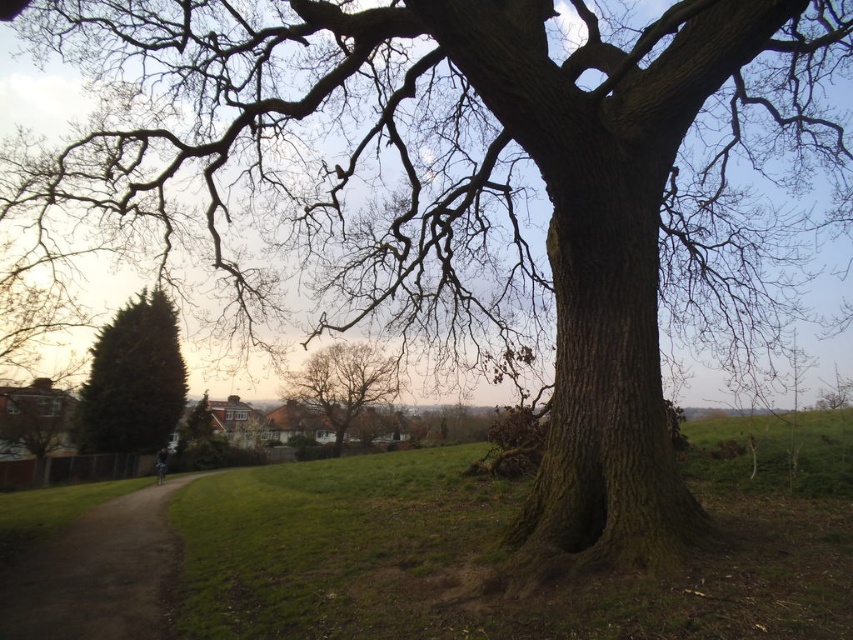
You are standing at the base of the large, mature tree with a thick trunk and sprawing branches. You see a point marked at coordinates [132,381]. What object is located at that point?

The point at coordinates [132,381] indicates a green textured hedge at left.